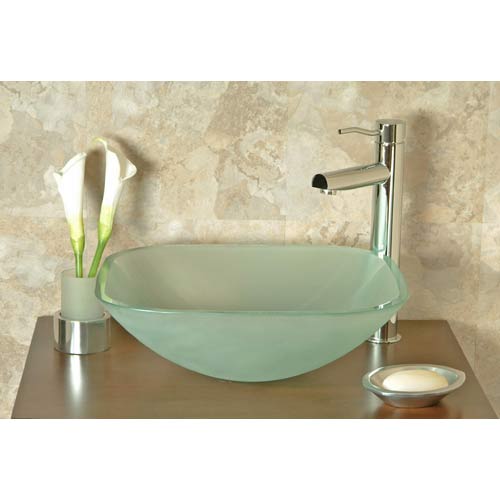
Locate an element on the screen. This screenshot has width=500, height=500. wall is located at coordinates (451, 194).